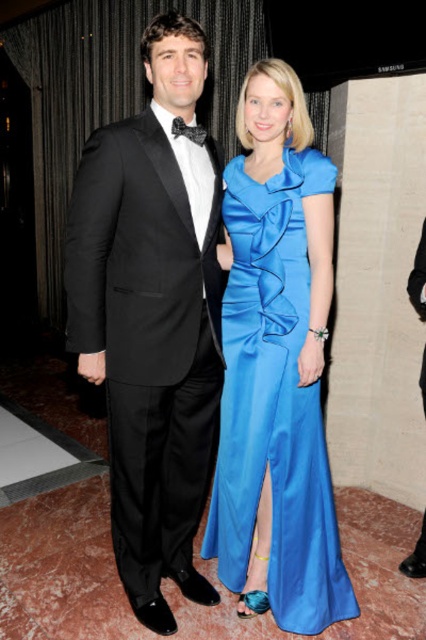
In the scene shown: You are a photographer setting up for a formal event. You need to ensure that the black satin tuxedo at left and the satin blue dress at center are within a 12 inch distance to frame them properly. Based on the scene description, can you confirm if they are close enough?

The black satin tuxedo at left is 10.78 inches away from the satin blue dress at center, which is within the 12 inch requirement, so they are close enough to frame properly.

You are a photographer setting up for a formal event. You need to position a light source to the right of the black satin tuxedo at left and to the left of the black satin bow tie at upper center. Is this possible based on their positions?

The black satin tuxedo at left is to the left of the black satin bow tie at upper center, so placing the light source to the right of the tuxedo and to the left of the bow tie is possible between them.